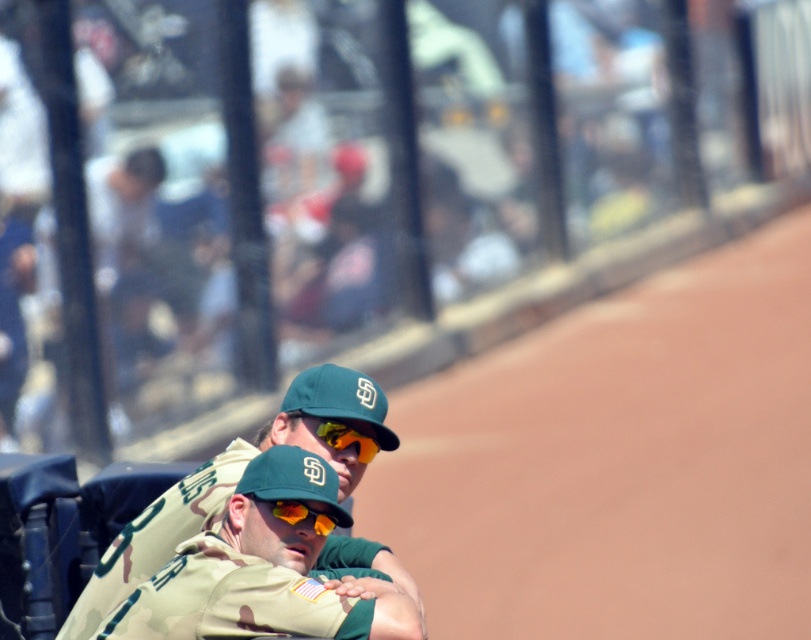
Can you confirm if camouflage uniform at center is wider than shiny orange plastic goggles at center?

Yes.

Between point (187, 496) and point (322, 522), which one is positioned in front?

Point (322, 522) is in front.

This screenshot has width=811, height=640. What do you see at coordinates (232, 484) in the screenshot?
I see `camouflage uniform at center` at bounding box center [232, 484].

The height and width of the screenshot is (640, 811). What are the coordinates of `camouflage uniform at center` in the screenshot? It's located at (232, 484).

Where is `camouflage uniform at center`? This screenshot has height=640, width=811. camouflage uniform at center is located at coordinates (x=232, y=484).

Which is above, camouflage uniform at center or shiny orange goggles at center?

shiny orange goggles at center is above.

Is point (82, 612) farther from camera compared to point (370, 448)?

Yes, point (82, 612) is behind point (370, 448).

I want to click on camouflage uniform at center, so click(x=232, y=484).

Does shiny orange goggles at center appear under shiny orange plastic goggles at center?

Actually, shiny orange goggles at center is above shiny orange plastic goggles at center.

Which of these two, shiny orange goggles at center or shiny orange plastic goggles at center, stands taller?

Standing taller between the two is shiny orange goggles at center.

Measure the distance between shiny orange goggles at center and camera.

shiny orange goggles at center and camera are 19.53 feet apart from each other.

In order to click on shiny orange goggles at center in this screenshot , I will do `click(346, 440)`.